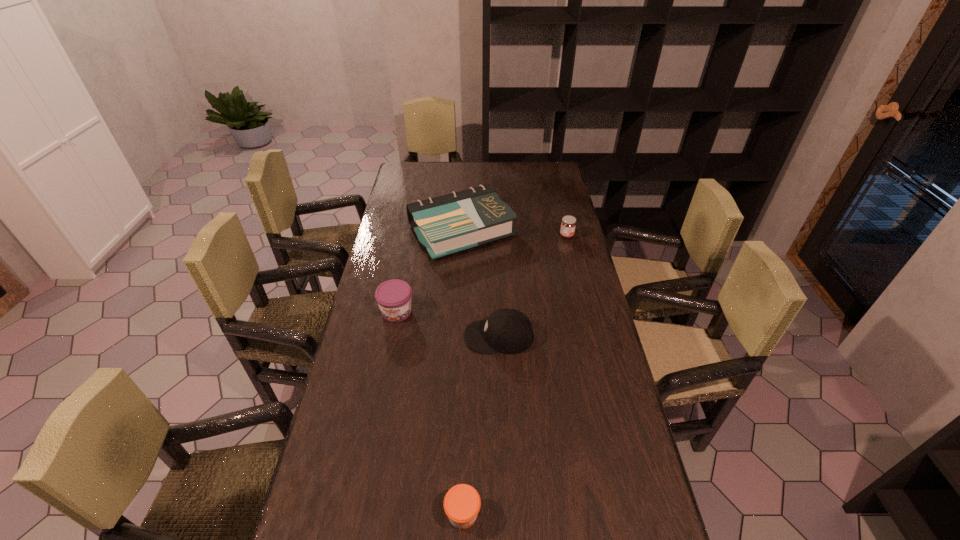
This screenshot has width=960, height=540. In the image, there is a desktop. Find the location of `vacant area at the right edge`. vacant area at the right edge is located at coordinates (563, 201).

The width and height of the screenshot is (960, 540). I want to click on vacant region between the leftmost jam and the paperback book, so click(429, 271).

Identify the location of blank region between the cap and the shortest jam. (481, 425).

What are the coordinates of `blank region between the second farthest jam and the farthest jam` in the screenshot? It's located at (482, 274).

Where is `free area in between the cap and the second shortest jam`? The height and width of the screenshot is (540, 960). free area in between the cap and the second shortest jam is located at coordinates (533, 286).

At what (x,y) coordinates should I click in order to perform the action: click on free space between the nearest object and the cap. Please return your answer as a coordinate pair (x, y). Looking at the image, I should click on (481, 425).

You are a GUI agent. You are given a task and a screenshot of the screen. Output one action in this format:
    pyautogui.click(x=<x>, y=<y>)
    Task: Click on the vacant area that lies between the cap and the second jam from left to right
    This screenshot has height=540, width=960.
    Given the screenshot: What is the action you would take?
    pyautogui.click(x=481, y=425)

Identify which object is the second closest to the cap. Please provide its 2D coordinates. Your answer should be formatted as a tuple, i.e. [(x, y)], where the tuple contains the x and y coordinates of a point satisfying the conditions above.

[(450, 223)]

Where is `object identified as the third closest to the cap`? This screenshot has height=540, width=960. object identified as the third closest to the cap is located at coordinates 462,503.

This screenshot has height=540, width=960. Find the location of `jam that stands as the second closest to the paperback book`. jam that stands as the second closest to the paperback book is located at coordinates (394, 296).